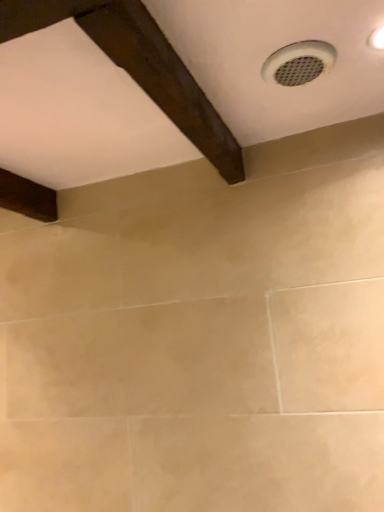
Question: Considering the positions of point (236, 182) and point (316, 54), is point (236, 182) closer or farther from the camera than point (316, 54)?

Choices:
 (A) closer
 (B) farther

Answer: (B)

Question: Is dark brown wood at upper left wider or thinner than white plastic vent at upper right?

Choices:
 (A) wide
 (B) thin

Answer: (A)

Question: From a real-world perspective, relative to white plastic vent at upper right, is dark brown wood at upper left vertically above or below?

Choices:
 (A) below
 (B) above

Answer: (A)

Question: From the image's perspective, relative to dark brown wood at upper left, is white plastic vent at upper right above or below?

Choices:
 (A) below
 (B) above

Answer: (B)

Question: In terms of height, does white plastic vent at upper right look taller or shorter compared to dark brown wood at upper left?

Choices:
 (A) tall
 (B) short

Answer: (B)

Question: From a real-world perspective, relative to dark brown wood at upper left, is white plastic vent at upper right vertically above or below?

Choices:
 (A) below
 (B) above

Answer: (B)

Question: Is white plastic vent at upper right situated inside dark brown wood at upper left or outside?

Choices:
 (A) inside
 (B) outside

Answer: (B)